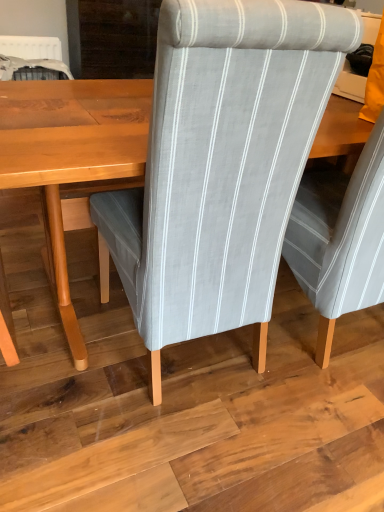
Image resolution: width=384 pixels, height=512 pixels. I want to click on free space that is to the left of light gray fabric chair at center, so click(56, 327).